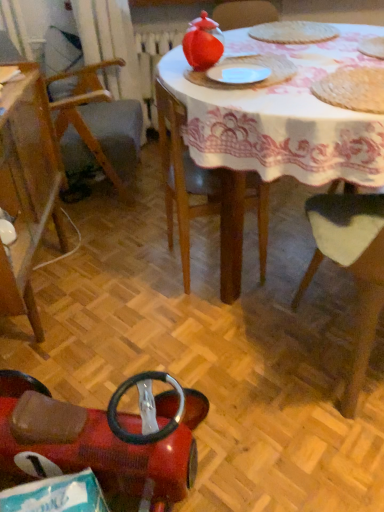
Question: Would you say white textured placemat at upper center, positioned as the 1th food in top-to-bottom order, contains white matte paper plate at center?

Choices:
 (A) no
 (B) yes

Answer: (A)

Question: Does white textured placemat at upper center, which is the 2th food from front to back, have a larger size compared to white matte paper plate at center?

Choices:
 (A) yes
 (B) no

Answer: (A)

Question: Is white textured placemat at upper center, placed as the 2th food when sorted from bottom to top, not inside white matte paper plate at center?

Choices:
 (A) no
 (B) yes

Answer: (B)

Question: Considering the relative positions of white textured placemat at upper center, positioned as the 1th food in top-to-bottom order, and white matte paper plate at center in the image provided, is white textured placemat at upper center, positioned as the 1th food in top-to-bottom order, in front of white matte paper plate at center?

Choices:
 (A) yes
 (B) no

Answer: (B)

Question: From the image's perspective, would you say white textured placemat at upper center, the first food when ordered from back to front, is positioned over white matte paper plate at center?

Choices:
 (A) no
 (B) yes

Answer: (B)

Question: Is white textured placemat at upper center, positioned as the 1th food in top-to-bottom order, oriented towards white matte paper plate at center?

Choices:
 (A) no
 (B) yes

Answer: (A)

Question: From the image's perspective, is rubberized red toy car at lower left, the second chair viewed from the left, above wooden chair at lower right, the 1th chair positioned from the right?

Choices:
 (A) yes
 (B) no

Answer: (B)

Question: Considering the relative sizes of rubberized red toy car at lower left, the second chair viewed from the left, and wooden chair at lower right, the 1th chair positioned from the right, in the image provided, is rubberized red toy car at lower left, the second chair viewed from the left, bigger than wooden chair at lower right, the 1th chair positioned from the right,?

Choices:
 (A) yes
 (B) no

Answer: (B)

Question: Considering the relative positions of rubberized red toy car at lower left, the second chair viewed from the left, and wooden chair at lower right, the 3th chair in the left-to-right sequence, in the image provided, is rubberized red toy car at lower left, the second chair viewed from the left, in front of wooden chair at lower right, the 3th chair in the left-to-right sequence,?

Choices:
 (A) yes
 (B) no

Answer: (A)

Question: From a real-world perspective, is rubberized red toy car at lower left, the second chair viewed from the left, physically below wooden chair at lower right, the 3th chair in the left-to-right sequence?

Choices:
 (A) yes
 (B) no

Answer: (A)

Question: Considering the relative sizes of rubberized red toy car at lower left, the second chair viewed from the left, and wooden chair at lower right, the 3th chair in the left-to-right sequence, in the image provided, is rubberized red toy car at lower left, the second chair viewed from the left, shorter than wooden chair at lower right, the 3th chair in the left-to-right sequence,?

Choices:
 (A) no
 (B) yes

Answer: (B)

Question: Does rubberized red toy car at lower left, the 2th chair positioned from the right, have a lesser width compared to wooden chair at lower right, the 3th chair in the left-to-right sequence?

Choices:
 (A) no
 (B) yes

Answer: (A)

Question: Is wooden chair at lower right, the 3th chair in the left-to-right sequence, outside of white matte paper plate at center?

Choices:
 (A) no
 (B) yes

Answer: (B)